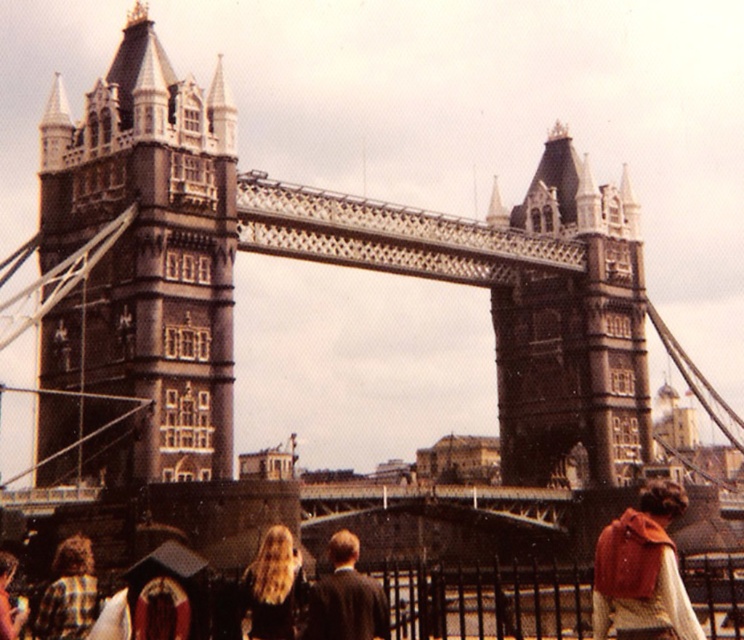
Does dark brown suit at center lie in front of plaid shirt at lower left?

Yes, it is.

Who is more forward, (333,616) or (60,579)?

Positioned in front is point (333,616).

Who is more forward, (356, 612) or (62, 636)?

Point (356, 612) is more forward.

I want to click on dark brown suit at center, so click(x=346, y=596).

Which of these two, brown stone tower at left or plaid shirt at lower left, stands taller?

Standing taller between the two is brown stone tower at left.

Consider the image. Does brown stone tower at left come in front of plaid shirt at lower left?

No.

Measure the distance between brown stone tower at left and camera.

They are 73.05 meters apart.

Find the location of a particular element. This screenshot has width=744, height=640. brown stone tower at left is located at coordinates [144, 262].

Does point (622, 323) lie behind point (333, 580)?

That is True.

Between dark gray stone tower at center and dark brown suit at center, which one is positioned lower?

dark brown suit at center is lower down.

Which is behind, point (554, 157) or point (341, 554)?

The point (554, 157) is more distant.

Identify the location of dark gray stone tower at center. This screenshot has width=744, height=640. (571, 330).